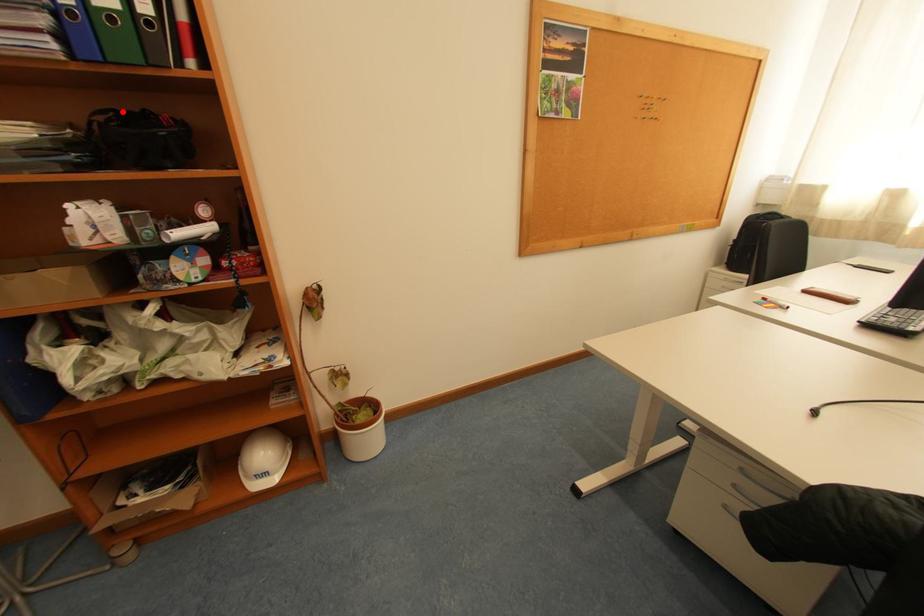
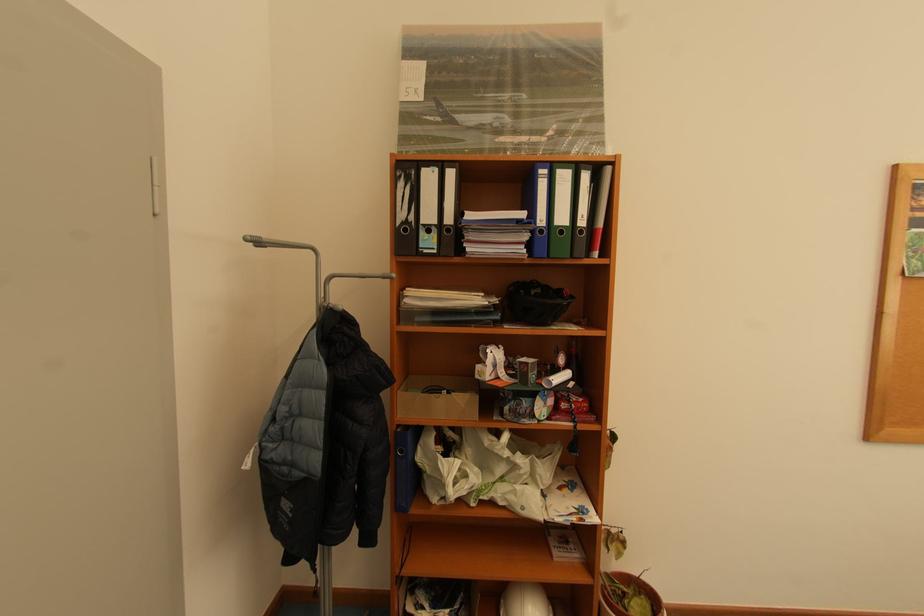
The point at the highlighted location is marked in the first image. Where is the corresponding point in the second image?

(526, 284)